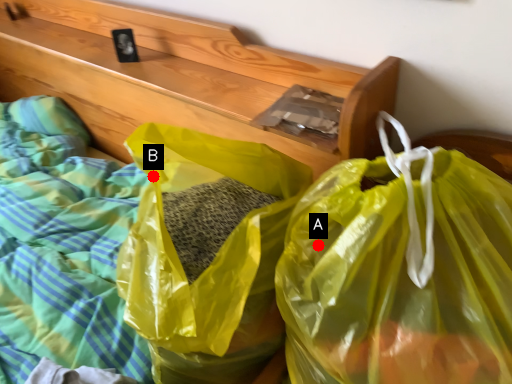
Question: Two points are circled on the image, labeled by A and B beside each circle. Which point is farther from the camera taking this photo?

Choices:
 (A) A is further
 (B) B is further

Answer: (B)